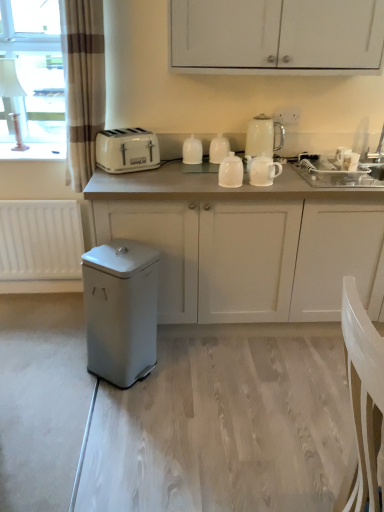
Find the location of a particular element. This screenshot has width=384, height=512. white glossy kettle at upper center, marked as the 1th kitchen appliance in a right-to-left arrangement is located at coordinates (264, 136).

This screenshot has width=384, height=512. Identify the location of white matte cabinet at upper center, the first cabinetry positioned from the top. (277, 36).

This screenshot has width=384, height=512. What do you see at coordinates (223, 428) in the screenshot?
I see `matte gray trash can at lower left` at bounding box center [223, 428].

Identify the location of white glossy mugs at upper center, the fourth kitchen appliance from the right. This screenshot has height=512, width=384. (218, 149).

Locate an element on the screen. This screenshot has height=512, width=384. white glossy cup at center, which is counted as the first kitchen appliance, starting from the left is located at coordinates (192, 151).

The image size is (384, 512). What do you see at coordinates (127, 150) in the screenshot?
I see `white plastic toaster at upper center` at bounding box center [127, 150].

Where is `white matte trash can at lower left`? This screenshot has width=384, height=512. white matte trash can at lower left is located at coordinates (121, 310).

Is brown striped curtain at left next to white glossy teapot at center, which is the third kitchen appliance in left-to-right order?

No, brown striped curtain at left is not making contact with white glossy teapot at center, which is the third kitchen appliance in left-to-right order.

Is brown striped curtain at left inside or outside of white glossy teapot at center, the third kitchen appliance in the right-to-left sequence?

brown striped curtain at left is outside white glossy teapot at center, the third kitchen appliance in the right-to-left sequence.

From a real-world perspective, relative to white glossy teapot at center, the third kitchen appliance in the right-to-left sequence, is brown striped curtain at left vertically above or below?

brown striped curtain at left is above white glossy teapot at center, the third kitchen appliance in the right-to-left sequence.

Is brown striped curtain at left wider than white glossy teapot at center, the third kitchen appliance in the right-to-left sequence?

Yes.

Based on the photo, between white glossy teapot at center, which is counted as the second kitchen appliance, starting from the right, and white glossy kettle at upper center, positioned as the 5th kitchen appliance in left-to-right order, which one has larger size?

With larger size is white glossy kettle at upper center, positioned as the 5th kitchen appliance in left-to-right order.

From a real-world perspective, is white glossy teapot at center, the 4th kitchen appliance in the left-to-right sequence, over white glossy kettle at upper center, marked as the 1th kitchen appliance in a right-to-left arrangement?

No, from a real-world perspective, white glossy teapot at center, the 4th kitchen appliance in the left-to-right sequence, is not above white glossy kettle at upper center, marked as the 1th kitchen appliance in a right-to-left arrangement.

Could you tell me if white glossy teapot at center, the 4th kitchen appliance in the left-to-right sequence, is facing white glossy kettle at upper center, positioned as the 5th kitchen appliance in left-to-right order?

No, white glossy teapot at center, the 4th kitchen appliance in the left-to-right sequence, does not turn towards white glossy kettle at upper center, positioned as the 5th kitchen appliance in left-to-right order.

Is point (268, 179) positioned behind point (279, 146)?

No, (268, 179) is in front of (279, 146).

From a real-world perspective, starting from the white matte trash can at lower left, which kitchen appliance is the 3rd one vertically above it? Please provide its 2D coordinates.

[(218, 149)]

Is white matte trash can at lower left touching white glossy mugs at upper center, the fourth kitchen appliance from the right?

No, white matte trash can at lower left is not next to white glossy mugs at upper center, the fourth kitchen appliance from the right.

Between white matte trash can at lower left and white glossy mugs at upper center, the fourth kitchen appliance from the right, which one has smaller width?

white glossy mugs at upper center, the fourth kitchen appliance from the right, is thinner.

Would you say white plastic toaster at upper center is inside or outside white glossy cup at center, which is counted as the first kitchen appliance, starting from the left?

white plastic toaster at upper center is not inside white glossy cup at center, which is counted as the first kitchen appliance, starting from the left, it's outside.

What's the angular difference between white plastic toaster at upper center and white glossy cup at center, which is counted as the first kitchen appliance, starting from the left,'s facing directions?

They differ by 29.9 degrees in their facing directions.

Visually, is white plastic toaster at upper center positioned to the left or to the right of white glossy cup at center, which is the fifth kitchen appliance from right to left?

In the image, white plastic toaster at upper center appears on the left side of white glossy cup at center, which is the fifth kitchen appliance from right to left.

In the scene shown: Who is bigger, white plastic toaster at upper center or white glossy cup at center, which is counted as the first kitchen appliance, starting from the left?

With larger size is white plastic toaster at upper center.

Is point (226, 216) behind point (260, 135)?

No, (226, 216) is in front of (260, 135).

Can you confirm if white matte cabinet at center, positioned as the 2th cabinetry in top-to-bottom order, is thinner than white glossy kettle at upper center, positioned as the 5th kitchen appliance in left-to-right order?

No, white matte cabinet at center, positioned as the 2th cabinetry in top-to-bottom order, is not thinner than white glossy kettle at upper center, positioned as the 5th kitchen appliance in left-to-right order.

Which object is positioned more to the left, white matte cabinet at center, which is the first cabinetry from bottom to top, or white glossy kettle at upper center, positioned as the 5th kitchen appliance in left-to-right order?

Positioned to the left is white glossy kettle at upper center, positioned as the 5th kitchen appliance in left-to-right order.

Is white matte cabinet at center, which is the first cabinetry from bottom to top, positioned with its back to white matte radiator at lower left?

No, white matte cabinet at center, which is the first cabinetry from bottom to top, is not facing away from white matte radiator at lower left.

Is white matte cabinet at center, positioned as the 2th cabinetry in top-to-bottom order, not inside white matte radiator at lower left?

Indeed, white matte cabinet at center, positioned as the 2th cabinetry in top-to-bottom order, is completely outside white matte radiator at lower left.

Can you tell me how much white glossy kettle at upper center, positioned as the 5th kitchen appliance in left-to-right order, and white glossy mugs at upper center, the fourth kitchen appliance from the right, differ in facing direction?

1.97 degrees.

Which object is positioned more to the left, white glossy kettle at upper center, positioned as the 5th kitchen appliance in left-to-right order, or white glossy mugs at upper center, marked as the second kitchen appliance in a left-to-right arrangement?

white glossy mugs at upper center, marked as the second kitchen appliance in a left-to-right arrangement, is more to the left.

Considering the sizes of objects white glossy kettle at upper center, marked as the 1th kitchen appliance in a right-to-left arrangement, and white glossy mugs at upper center, the fourth kitchen appliance from the right, in the image provided, who is thinner, white glossy kettle at upper center, marked as the 1th kitchen appliance in a right-to-left arrangement, or white glossy mugs at upper center, the fourth kitchen appliance from the right,?

With smaller width is white glossy mugs at upper center, the fourth kitchen appliance from the right.

Considering the sizes of objects white glossy kettle at upper center, marked as the 1th kitchen appliance in a right-to-left arrangement, and white glossy mugs at upper center, the fourth kitchen appliance from the right, in the image provided, who is shorter, white glossy kettle at upper center, marked as the 1th kitchen appliance in a right-to-left arrangement, or white glossy mugs at upper center, the fourth kitchen appliance from the right,?

white glossy mugs at upper center, the fourth kitchen appliance from the right.

This screenshot has width=384, height=512. In order to click on the 4th kitchen appliance below the brown striped curtain at left (from the image's perspective) in this screenshot , I will do [x=231, y=170].

Locate an element on the screen. The height and width of the screenshot is (512, 384). the 1st kitchen appliance directly beneath the white glossy kettle at upper center, positioned as the 5th kitchen appliance in left-to-right order (from a real-world perspective) is located at coordinates (263, 170).

Looking at the image, which one is located further to brown striped curtain at left, white matte cabinet at upper center, arranged as the 2th cabinetry when ordered from the bottom, or white glossy teapot at center, the 4th kitchen appliance in the left-to-right sequence?

white glossy teapot at center, the 4th kitchen appliance in the left-to-right sequence, is further to brown striped curtain at left.

Based on their spatial positions, is brown striped curtain at left or white matte radiator at lower left closer to white glossy teapot at center, which is counted as the second kitchen appliance, starting from the right?

Among the two, brown striped curtain at left is located nearer to white glossy teapot at center, which is counted as the second kitchen appliance, starting from the right.

Considering their positions, is white matte radiator at lower left positioned closer to brown striped curtain at left than white glossy mugs at upper center, the fourth kitchen appliance from the right?

The object closer to brown striped curtain at left is white matte radiator at lower left.

Estimate the real-world distances between objects in this image. Which object is closer to white plastic toaster at upper center, white glossy teapot at center, which is counted as the second kitchen appliance, starting from the right, or white matte trash can at lower left?

The object closer to white plastic toaster at upper center is white glossy teapot at center, which is counted as the second kitchen appliance, starting from the right.

Looking at the image, which one is located closer to white glossy teapot at center, the 4th kitchen appliance in the left-to-right sequence, white matte radiator at lower left or white matte cabinet at upper center, arranged as the 2th cabinetry when ordered from the bottom?

white matte cabinet at upper center, arranged as the 2th cabinetry when ordered from the bottom.

Looking at the image, which one is located closer to white glossy teapot at center, which is counted as the second kitchen appliance, starting from the right, white glossy mugs at upper center, the fourth kitchen appliance from the right, or white glossy kettle at upper center, marked as the 1th kitchen appliance in a right-to-left arrangement?

Among the two, white glossy kettle at upper center, marked as the 1th kitchen appliance in a right-to-left arrangement, is located nearer to white glossy teapot at center, which is counted as the second kitchen appliance, starting from the right.

From the image, which object appears to be nearer to white glossy mugs at upper center, marked as the second kitchen appliance in a left-to-right arrangement, white glossy cup at center, which is counted as the first kitchen appliance, starting from the left, or white matte cabinet at upper center, arranged as the 2th cabinetry when ordered from the bottom?

white glossy cup at center, which is counted as the first kitchen appliance, starting from the left.

Looking at this image, which object lies further to the anchor point white matte cabinet at center, which is the first cabinetry from bottom to top, white glossy mugs at upper center, marked as the second kitchen appliance in a left-to-right arrangement, or white plastic toaster at upper center?

white glossy mugs at upper center, marked as the second kitchen appliance in a left-to-right arrangement, is positioned further to the anchor white matte cabinet at center, which is the first cabinetry from bottom to top.

At what (x,y) coordinates should I click in order to perform the action: click on kitchen appliance situated between white matte radiator at lower left and white glossy mugs at upper center, the fourth kitchen appliance from the right, from left to right. Please return your answer as a coordinate pair (x, y). Image resolution: width=384 pixels, height=512 pixels. Looking at the image, I should click on (192, 151).

Find the location of a particular element. The image size is (384, 512). kitchen appliance located between white plastic toaster at upper center and white glossy mugs at upper center, marked as the second kitchen appliance in a left-to-right arrangement, in the left-right direction is located at coordinates point(192,151).

This screenshot has width=384, height=512. Identify the location of cabinetry between white glossy cup at center, which is the fifth kitchen appliance from right to left, and matte gray trash can at lower left, in the vertical direction. (245, 244).

Find the location of a particular element. plain between white matte radiator at lower left and white glossy mugs at upper center, the fourth kitchen appliance from the right is located at coordinates (223, 428).